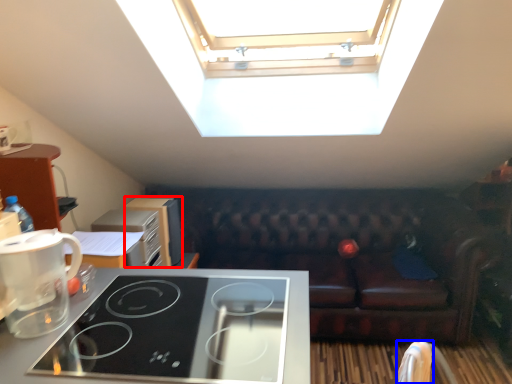
Question: Which point is further to the camera, appliance (highlighted by a red box) or armchair (highlighted by a blue box)?

Choices:
 (A) appliance
 (B) armchair

Answer: (A)